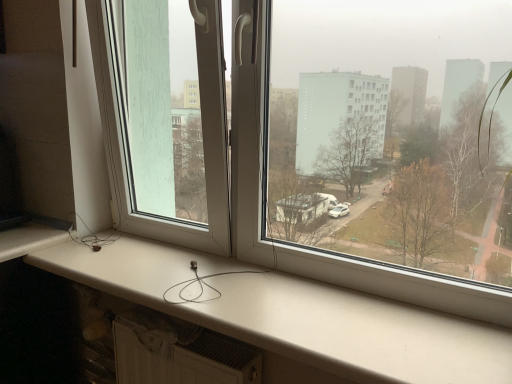
I want to click on free region under transparent plastic window screen at left (from a real-world perspective), so click(138, 260).